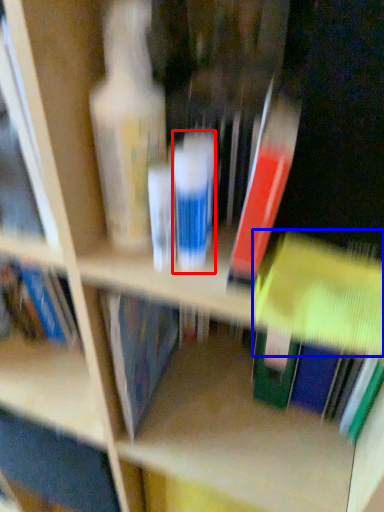
Question: Which object is further to the camera taking this photo, toiletry (highlighted by a red box) or book (highlighted by a blue box)?

Choices:
 (A) toiletry
 (B) book

Answer: (A)